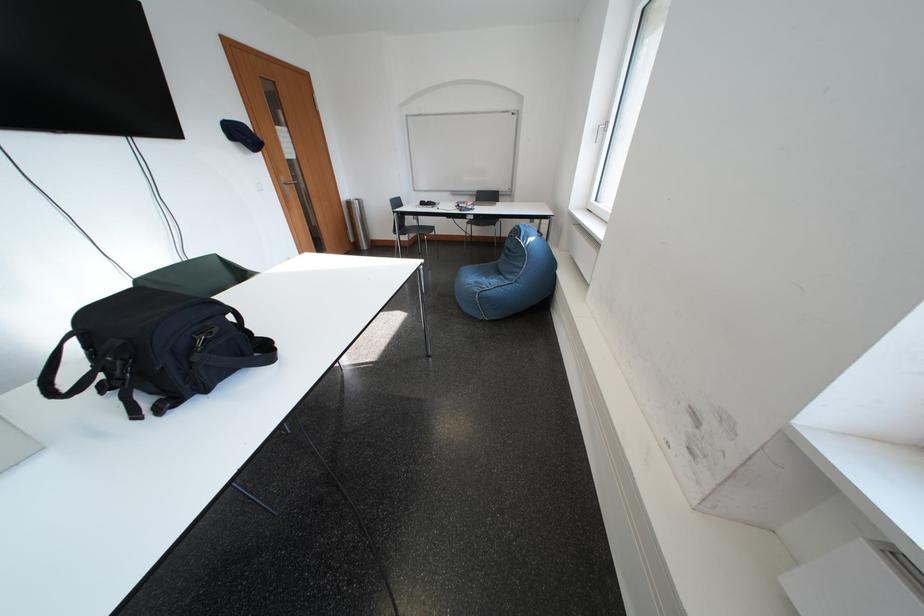
Where would you push the silver door handle? Please return your answer as a coordinate pair (x, y).

(286, 185)